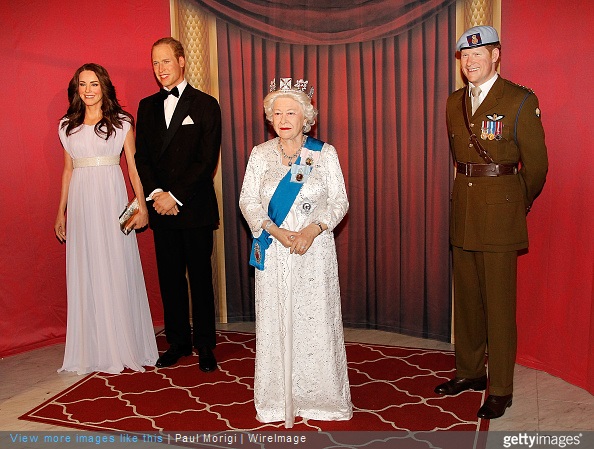
Identify the location of red walls. (55, 43), (561, 64).